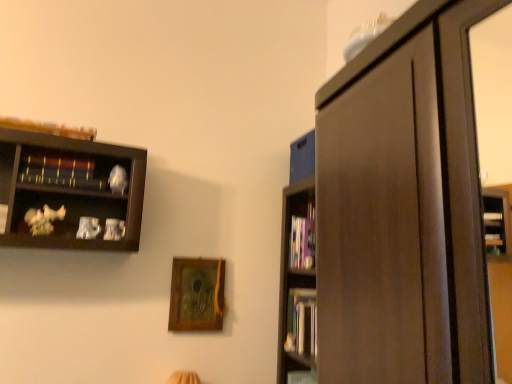
Question: Would you say hardcover books at right, the third book in the front-to-back sequence, is outside wooden book at upper left, which is counted as the 1th book, starting from the left?

Choices:
 (A) yes
 (B) no

Answer: (A)

Question: Can you confirm if hardcover books at right, which appears as the third book when viewed from the left, is thinner than wooden book at upper left, which is the 1th book in top-to-bottom order?

Choices:
 (A) yes
 (B) no

Answer: (B)

Question: Does hardcover books at right, the third book in the front-to-back sequence, have a greater width compared to wooden book at upper left, which ranks as the fourth book in right-to-left order?

Choices:
 (A) no
 (B) yes

Answer: (B)

Question: Is hardcover books at right, marked as the 1th book in a bottom-to-top arrangement, shorter than wooden book at upper left, the 1th book from the front?

Choices:
 (A) yes
 (B) no

Answer: (B)

Question: Considering the relative sizes of hardcover books at right, the third book in the front-to-back sequence, and wooden book at upper left, acting as the 4th book starting from the back, in the image provided, is hardcover books at right, the third book in the front-to-back sequence, bigger than wooden book at upper left, acting as the 4th book starting from the back,?

Choices:
 (A) no
 (B) yes

Answer: (B)

Question: From a real-world perspective, is hardcover books at right, the 2th book positioned from the back, on top of wooden book at upper left, which ranks as the fourth book in right-to-left order?

Choices:
 (A) no
 (B) yes

Answer: (A)

Question: From a real-world perspective, does hardcover books at right, the 2th book positioned from the back, stand above hardcover book at center, arranged as the third book when viewed from the top?

Choices:
 (A) no
 (B) yes

Answer: (A)

Question: Does hardcover books at right, which appears as the third book when viewed from the left, turn towards hardcover book at center, acting as the fourth book starting from the front?

Choices:
 (A) yes
 (B) no

Answer: (B)

Question: Considering the relative sizes of hardcover books at right, which appears as the third book when viewed from the left, and hardcover book at center, acting as the fourth book starting from the front, in the image provided, is hardcover books at right, which appears as the third book when viewed from the left, smaller than hardcover book at center, acting as the fourth book starting from the front,?

Choices:
 (A) no
 (B) yes

Answer: (A)

Question: Can you confirm if hardcover books at right, marked as the 1th book in a bottom-to-top arrangement, is wider than hardcover book at center, arranged as the third book when viewed from the top?

Choices:
 (A) no
 (B) yes

Answer: (A)

Question: Is hardcover books at right, marked as the second book in a right-to-left arrangement, outside of hardcover book at center, which is counted as the first book, starting from the right?

Choices:
 (A) no
 (B) yes

Answer: (B)

Question: Does hardcover books at right, marked as the second book in a right-to-left arrangement, have a greater height compared to hardcover book at center, which is counted as the first book, starting from the right?

Choices:
 (A) yes
 (B) no

Answer: (A)

Question: Is wooden picture frame at center not within wooden bookshelf at upper left, which is the 3th book from back to front?

Choices:
 (A) no
 (B) yes

Answer: (B)